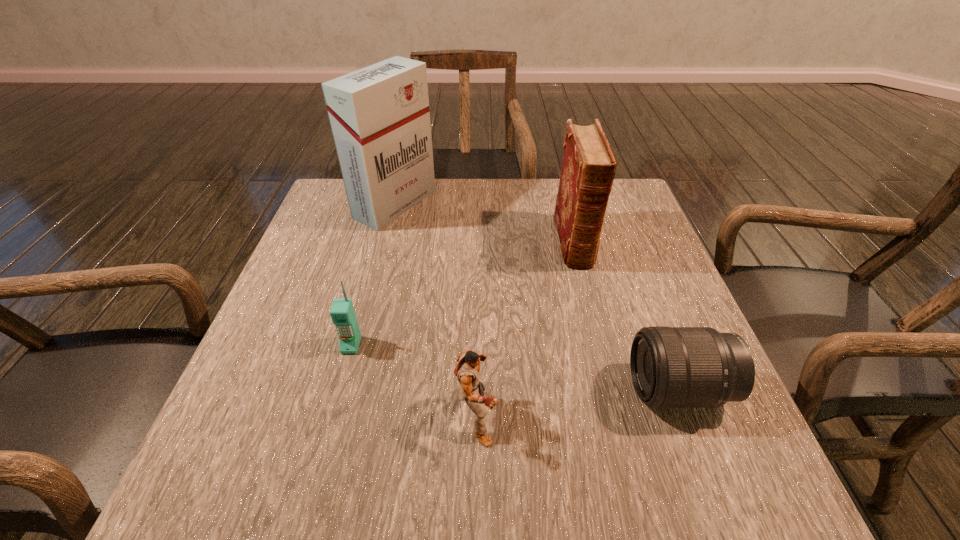
Locate an element on the screen. the tallest object is located at coordinates (379, 115).

Identify the location of the second tallest object. The width and height of the screenshot is (960, 540). (588, 167).

At what (x,y) coordinates should I click in order to perform the action: click on hardback book. Please return your answer as a coordinate pair (x, y). The image size is (960, 540). Looking at the image, I should click on (588, 167).

This screenshot has height=540, width=960. What are the coordinates of `puncher` in the screenshot? It's located at (471, 389).

You are a GUI agent. You are given a task and a screenshot of the screen. Output one action in this format:
    pyautogui.click(x=<x>, y=<y>)
    Task: Click on the cellular telephone
    The image size is (960, 540).
    Given the screenshot: What is the action you would take?
    pyautogui.click(x=342, y=312)

Locate an element on the screen. This screenshot has width=960, height=540. the shortest object is located at coordinates (671, 367).

The width and height of the screenshot is (960, 540). Identify the location of telephoto lens. (671, 367).

This screenshot has height=540, width=960. Identify the location of free space located on the left of the tallest object. (325, 204).

This screenshot has height=540, width=960. In order to click on free space located 0.290m on the spine side of the hardback book in this screenshot , I will do `click(607, 375)`.

I want to click on vacant position located 0.340m on the front-facing side of the puncher, so click(692, 414).